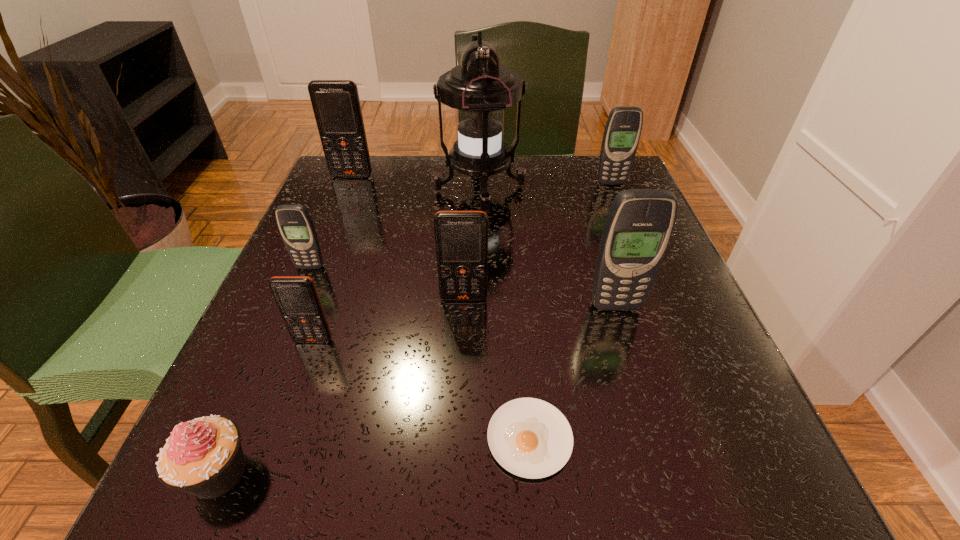
This screenshot has width=960, height=540. Identify the location of vacant region that satisfies the following two spatial constraints: 1. on the screen of the seventh farthest object; 2. on the left side of the shortest object. (279, 438).